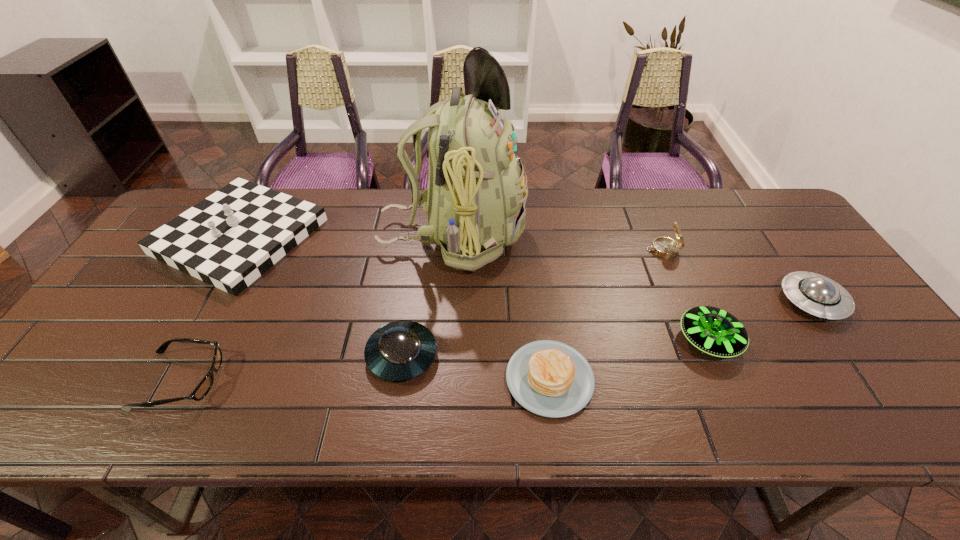
Where is `backpack`? backpack is located at coordinates (475, 200).

Where is `the seventh shortest object`? the seventh shortest object is located at coordinates (228, 240).

This screenshot has width=960, height=540. I want to click on compass, so click(664, 247).

I want to click on the second saucer from right to left, so click(x=714, y=331).

This screenshot has height=540, width=960. In order to click on the rightmost object in this screenshot , I will do `click(815, 294)`.

Image resolution: width=960 pixels, height=540 pixels. I want to click on the leftmost saucer, so click(x=401, y=350).

This screenshot has width=960, height=540. Find the location of `pancake`. pancake is located at coordinates (548, 378).

The image size is (960, 540). In order to click on spectacles in this screenshot , I will do `click(203, 388)`.

Image resolution: width=960 pixels, height=540 pixels. Identify the location of vacant space positioned on the front-facing side of the tallest object. (561, 235).

You are a GUI agent. You are given a task and a screenshot of the screen. Output one action in this format:
    pyautogui.click(x=<x>, y=<y>)
    Task: Click on the vacant region located on the front of the seventh shortest object
    This screenshot has width=960, height=540.
    Given the screenshot: What is the action you would take?
    pyautogui.click(x=131, y=428)